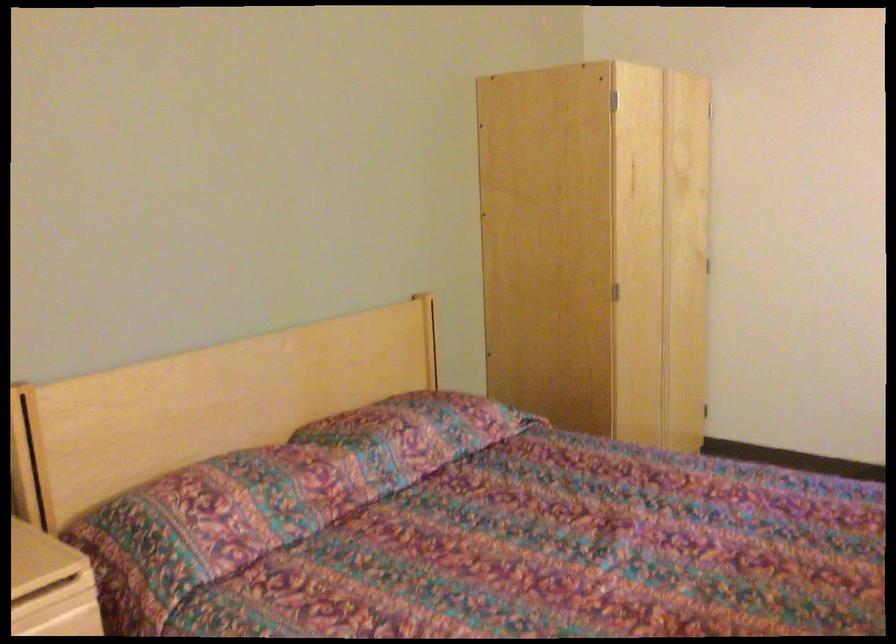
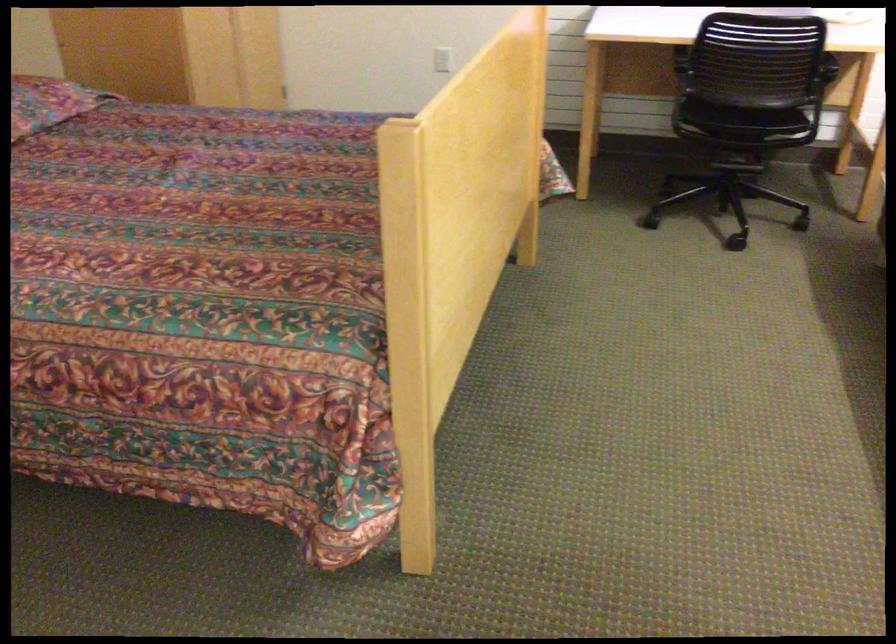
Locate, in the second image, the point that corresponds to [477,418] in the first image.

(48, 102)